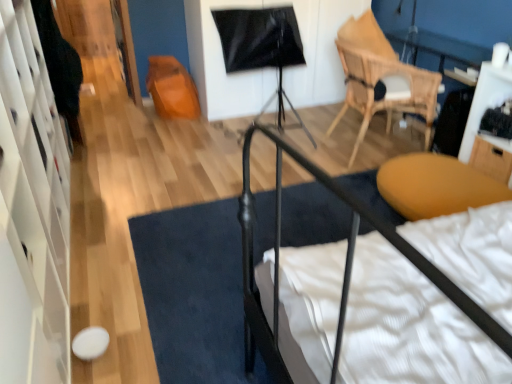
Question: Is black fabric doormat at center located within white glossy dresser at left?

Choices:
 (A) no
 (B) yes

Answer: (A)

Question: Is white glossy dresser at left positioned behind black fabric doormat at center?

Choices:
 (A) yes
 (B) no

Answer: (B)

Question: From a real-world perspective, is white glossy dresser at left over black fabric doormat at center?

Choices:
 (A) no
 (B) yes

Answer: (B)

Question: From a real-world perspective, is white glossy dresser at left below black fabric doormat at center?

Choices:
 (A) no
 (B) yes

Answer: (A)

Question: Considering the relative sizes of white glossy dresser at left and black fabric doormat at center in the image provided, is white glossy dresser at left shorter than black fabric doormat at center?

Choices:
 (A) no
 (B) yes

Answer: (A)

Question: In the image, is white glossy dresser at left on the left side or the right side of natural wood chair at upper right?

Choices:
 (A) left
 (B) right

Answer: (A)

Question: Relative to natural wood chair at upper right, is white glossy dresser at left in front or behind?

Choices:
 (A) front
 (B) behind

Answer: (A)

Question: From a real-world perspective, is white glossy dresser at left positioned above or below natural wood chair at upper right?

Choices:
 (A) above
 (B) below

Answer: (A)

Question: Which is correct: white glossy dresser at left is inside natural wood chair at upper right, or outside of it?

Choices:
 (A) inside
 (B) outside

Answer: (B)

Question: Is wooden table at right situated inside white glossy dresser at left or outside?

Choices:
 (A) inside
 (B) outside

Answer: (B)

Question: Visually, is wooden table at right positioned to the left or to the right of white glossy dresser at left?

Choices:
 (A) right
 (B) left

Answer: (A)

Question: Considering the positions of point (493, 69) and point (24, 115), is point (493, 69) closer or farther from the camera than point (24, 115)?

Choices:
 (A) closer
 (B) farther

Answer: (B)

Question: Relative to white glossy dresser at left, is wooden table at right in front or behind?

Choices:
 (A) behind
 (B) front

Answer: (A)

Question: Would you say wooden drawer at right is inside or outside black fabric at left?

Choices:
 (A) inside
 (B) outside

Answer: (B)

Question: From a real-world perspective, is wooden drawer at right above or below black fabric at left?

Choices:
 (A) below
 (B) above

Answer: (A)